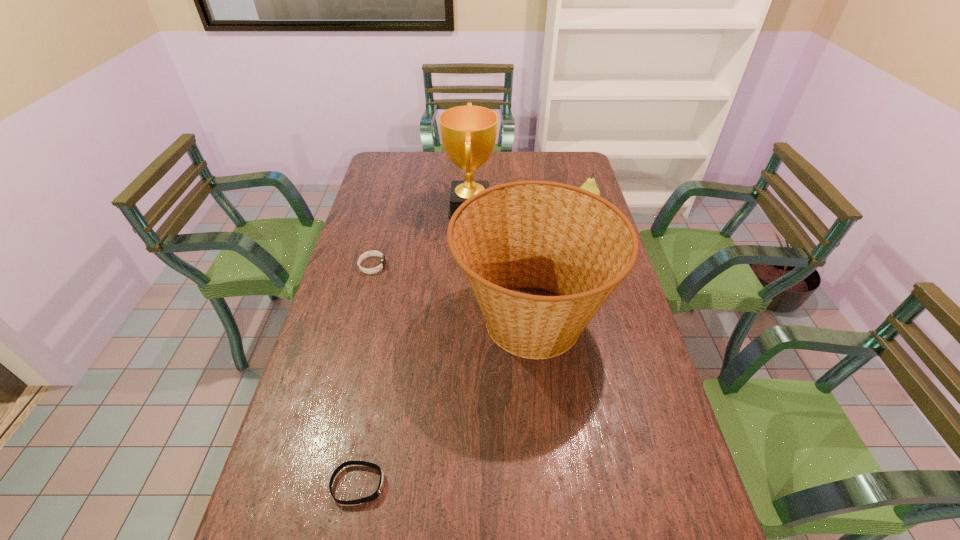
At what (x,y) coordinates should I click in order to perform the action: click on award. Please return your answer as a coordinate pair (x, y). Looking at the image, I should click on (468, 133).

The width and height of the screenshot is (960, 540). Identify the location of basket. (528, 234).

This screenshot has width=960, height=540. Identify the location of pear. [x=590, y=185].

Locate an element on the screen. This screenshot has height=540, width=960. the taller wristband is located at coordinates (369, 253).

This screenshot has height=540, width=960. In order to click on the fourth tallest object in this screenshot , I will do `click(369, 253)`.

Image resolution: width=960 pixels, height=540 pixels. Find the location of `the nearer wristband`. the nearer wristband is located at coordinates (381, 484).

Find the location of `the shorter wristband`. the shorter wristband is located at coordinates [x=381, y=484].

Find the location of a particular element. Image resolution: width=960 pixels, height=540 pixels. free space located 0.150m on the front-facing side of the award is located at coordinates (534, 207).

Image resolution: width=960 pixels, height=540 pixels. Find the location of `free space located on the front of the basket`. free space located on the front of the basket is located at coordinates (547, 464).

You are a GUI agent. You are given a task and a screenshot of the screen. Output one action in this format:
    pyautogui.click(x=<x>, y=<y>)
    Task: Click on the vacant point located on the left of the third tallest object
    
    Given the screenshot: What is the action you would take?
    538,202